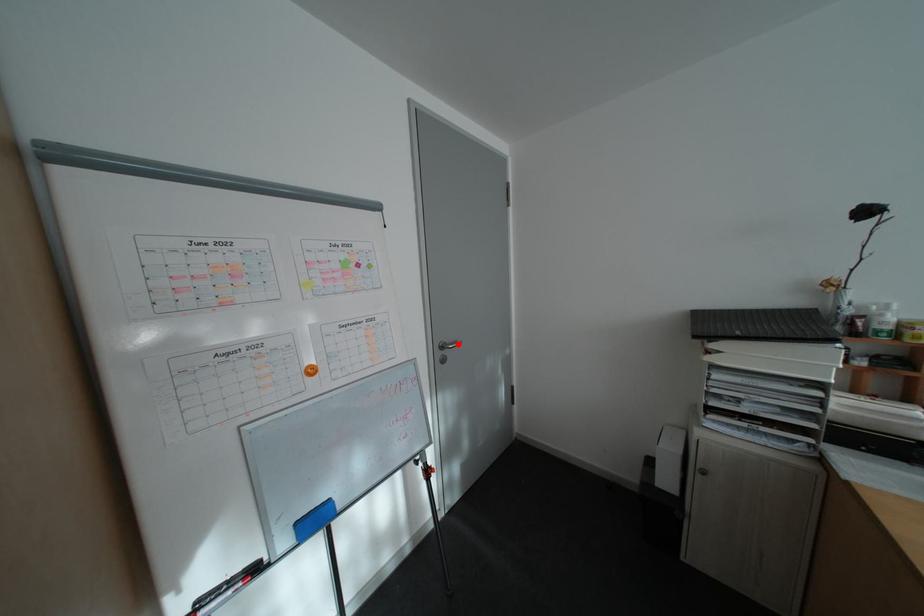
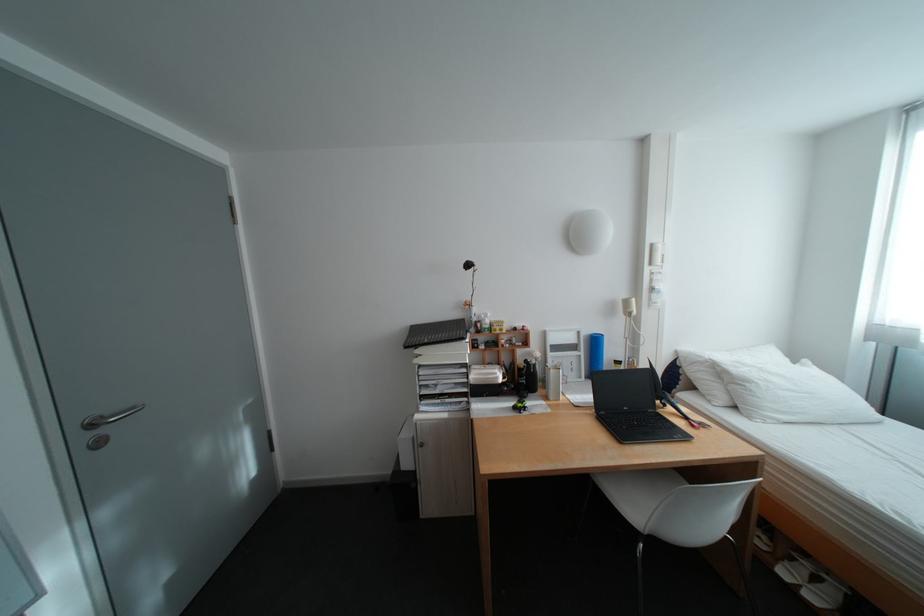
In the second image, find the point that corresponds to the highlighted location in the first image.

(115, 418)